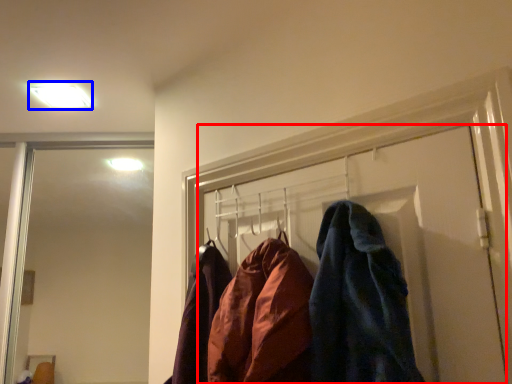
Question: Which of the following is the farthest to the observer, door (highlighted by a red box) or light fixture (highlighted by a blue box)?

Choices:
 (A) door
 (B) light fixture

Answer: (B)